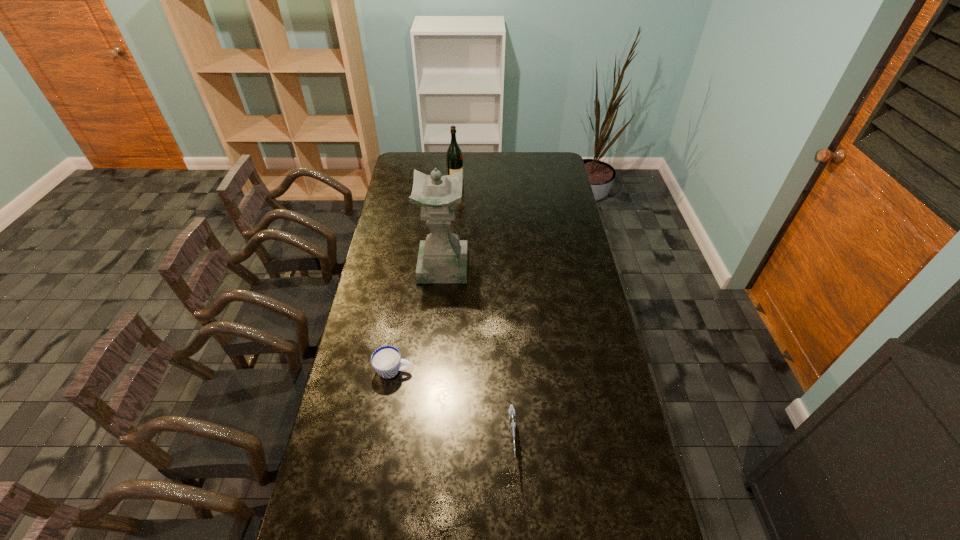
I want to click on the second farthest object, so click(x=442, y=258).

Locate an element on the screen. The width and height of the screenshot is (960, 540). the tallest object is located at coordinates (442, 258).

This screenshot has width=960, height=540. I want to click on the farthest object, so coord(454,159).

Locate an element on the screen. the second tallest object is located at coordinates (454, 159).

At what (x,y) coordinates should I click in order to perform the action: click on the nearest object. Please return your answer as a coordinate pair (x, y). This screenshot has height=540, width=960. Looking at the image, I should click on (512, 418).

Locate an element on the screen. gun is located at coordinates (512, 418).

Locate an element on the screen. Image resolution: width=960 pixels, height=540 pixels. cup is located at coordinates (386, 360).

The image size is (960, 540). I want to click on free location located at the front opening of the tallest object, so click(x=438, y=328).

Locate an element on the screen. vacant area located on the front-facing side of the farthest object is located at coordinates (497, 185).

Locate an element on the screen. vacant space located 0.140m at the barrel of the rightmost object is located at coordinates (516, 522).